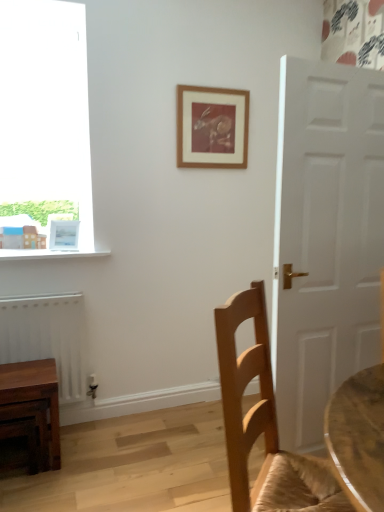
Question: Is light brown wood chair at right beside wooden picture frame at upper center, which is counted as the 1th picture frame, starting from the right?

Choices:
 (A) no
 (B) yes

Answer: (A)

Question: Considering the relative positions of light brown wood chair at right and wooden picture frame at upper center, arranged as the first picture frame when viewed from the top, in the image provided, is light brown wood chair at right behind wooden picture frame at upper center, arranged as the first picture frame when viewed from the top,?

Choices:
 (A) yes
 (B) no

Answer: (B)

Question: Is light brown wood chair at right located outside wooden picture frame at upper center, which is counted as the 2th picture frame, starting from the bottom?

Choices:
 (A) no
 (B) yes

Answer: (B)

Question: Is light brown wood chair at right positioned far away from wooden picture frame at upper center, marked as the 2th picture frame in a left-to-right arrangement?

Choices:
 (A) yes
 (B) no

Answer: (A)

Question: Could wooden picture frame at upper center, arranged as the first picture frame when viewed from the top, be considered to be inside light brown wood chair at right?

Choices:
 (A) no
 (B) yes

Answer: (A)

Question: From a real-world perspective, does light brown wood chair at right sit lower than wooden picture frame at upper center, which is counted as the 1th picture frame, starting from the right?

Choices:
 (A) no
 (B) yes

Answer: (B)

Question: Is white glossy picture frame at upper left, acting as the 1th picture frame starting from the left, next to white matte radiator at lower left and touching it?

Choices:
 (A) no
 (B) yes

Answer: (A)

Question: From a real-world perspective, is white glossy picture frame at upper left, which ranks as the 2th picture frame in right-to-left order, located beneath white matte radiator at lower left?

Choices:
 (A) yes
 (B) no

Answer: (B)

Question: Is white glossy picture frame at upper left, acting as the 1th picture frame starting from the left, closer to the viewer compared to white matte radiator at lower left?

Choices:
 (A) no
 (B) yes

Answer: (A)

Question: Could white matte radiator at lower left be considered to be inside white glossy picture frame at upper left, acting as the 1th picture frame starting from the left?

Choices:
 (A) yes
 (B) no

Answer: (B)

Question: Can you confirm if white glossy picture frame at upper left, which ranks as the 2th picture frame in right-to-left order, is taller than white matte radiator at lower left?

Choices:
 (A) yes
 (B) no

Answer: (B)

Question: From the image's perspective, is white glossy picture frame at upper left, acting as the 1th picture frame starting from the left, on white matte radiator at lower left?

Choices:
 (A) yes
 (B) no

Answer: (A)

Question: Can you confirm if wooden table at lower left is thinner than wooden picture frame at upper center, arranged as the first picture frame when viewed from the top?

Choices:
 (A) no
 (B) yes

Answer: (A)